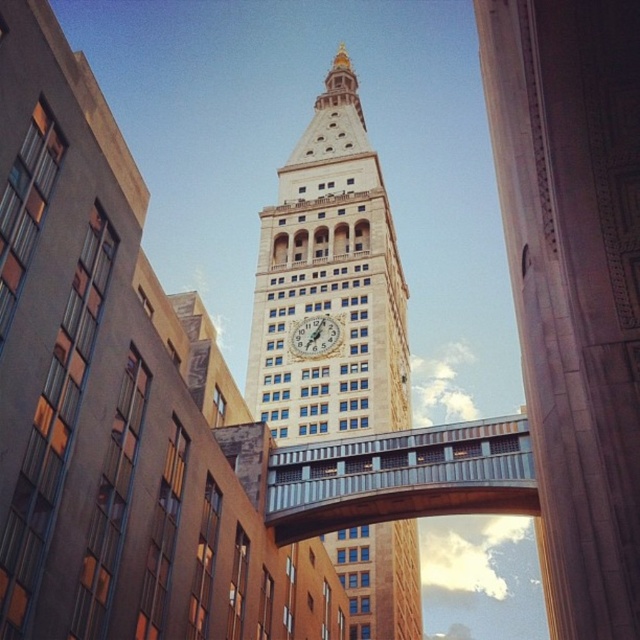
Does beige stone clock tower at center have a larger size compared to white stone clock at center?

Yes, beige stone clock tower at center is bigger than white stone clock at center.

Is point (394, 522) less distant than point (304, 348)?

Yes, it is.

Where is `beige stone clock tower at center`? Image resolution: width=640 pixels, height=640 pixels. beige stone clock tower at center is located at coordinates (330, 282).

Where is `beige stone clock tower at center`? This screenshot has width=640, height=640. beige stone clock tower at center is located at coordinates (330, 282).

Is beige stone clock tower at center bigger than metal/textured bridge at center?

Yes, beige stone clock tower at center is bigger than metal/textured bridge at center.

Is beige stone clock tower at center taller than metal/textured bridge at center?

Indeed, beige stone clock tower at center has a greater height compared to metal/textured bridge at center.

Find the location of a particular element. The height and width of the screenshot is (640, 640). beige stone clock tower at center is located at coordinates (330, 282).

This screenshot has width=640, height=640. Describe the element at coordinates (573, 282) in the screenshot. I see `marble column at center` at that location.

Is point (618, 26) in front of point (333, 339)?

Yes.

Is point (620, 145) in front of point (321, 320)?

Yes, point (620, 145) is in front of point (321, 320).

Locate an element on the screen. The image size is (640, 640). marble column at center is located at coordinates (573, 282).